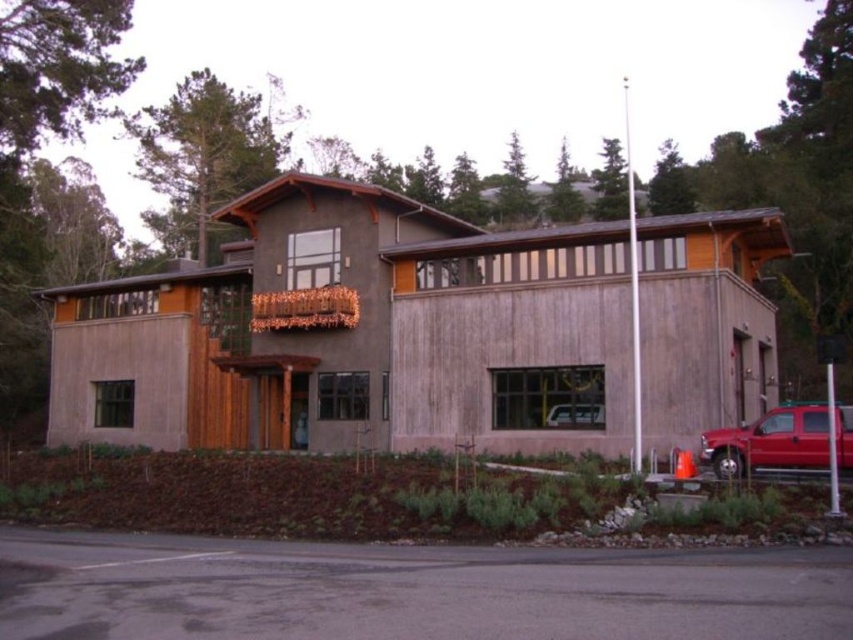
Question: Which point is closer to the camera?

Choices:
 (A) (289, 509)
 (B) (567, 420)
 (C) (704, 440)

Answer: (A)

Question: Where is brown mulch at lower left located in relation to metallic silver car at center in the image?

Choices:
 (A) right
 (B) left

Answer: (B)

Question: Which object appears farthest from the camera in this image?

Choices:
 (A) matte red truck at lower right
 (B) metallic silver car at center
 (C) brown mulch at lower left

Answer: (B)

Question: Is matte red truck at lower right behind metallic silver car at center?

Choices:
 (A) yes
 (B) no

Answer: (B)

Question: Does brown mulch at lower left have a lesser width compared to matte red truck at lower right?

Choices:
 (A) no
 (B) yes

Answer: (A)

Question: Which object is positioned closest to the matte red truck at lower right?

Choices:
 (A) brown mulch at lower left
 (B) metallic silver car at center

Answer: (B)